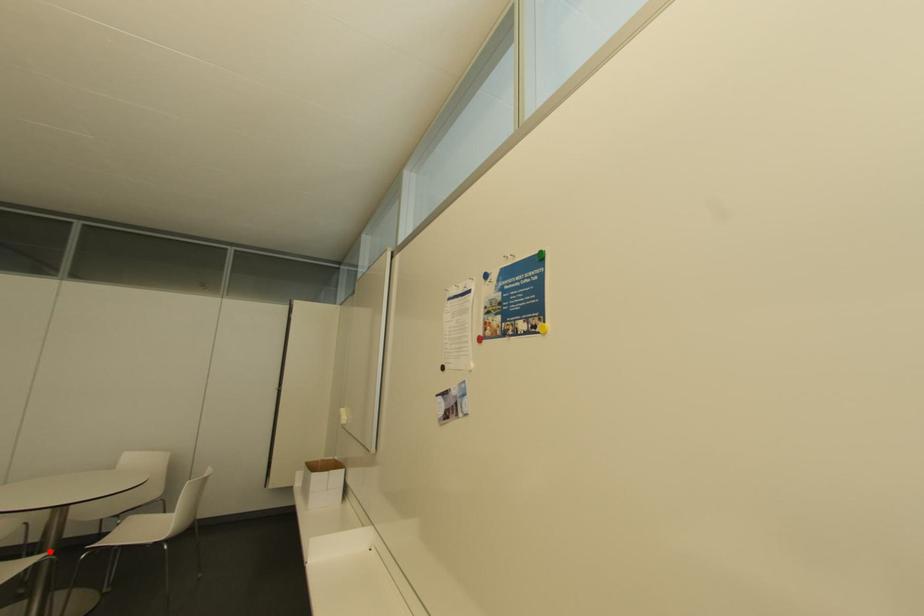
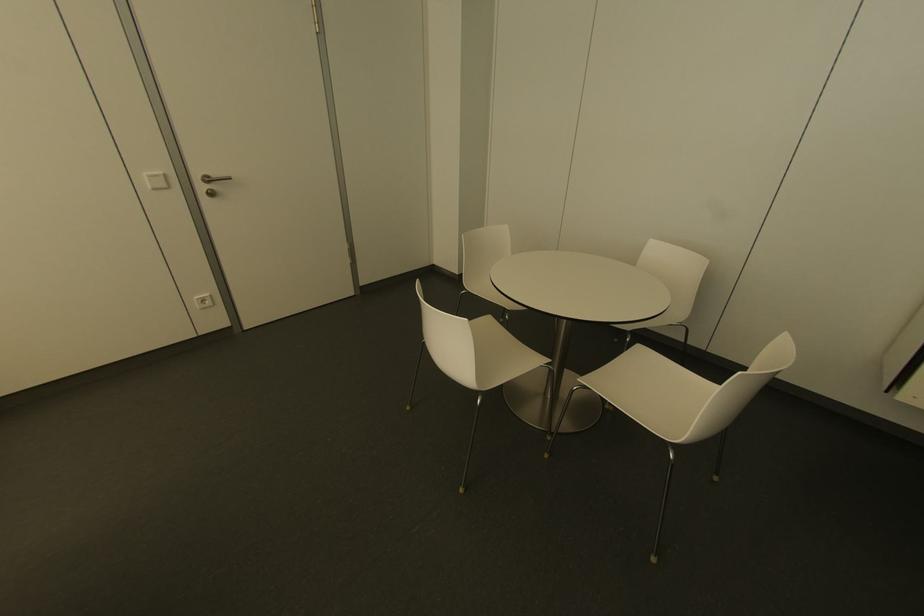
Question: I am providing you with two images of the same scene from different viewpoints. Given a red point in image1, look at the same physical point in image2. Is it:

Choices:
 (A) Closer to the viewpoint
 (B) Farther from the viewpoint

Answer: (B)